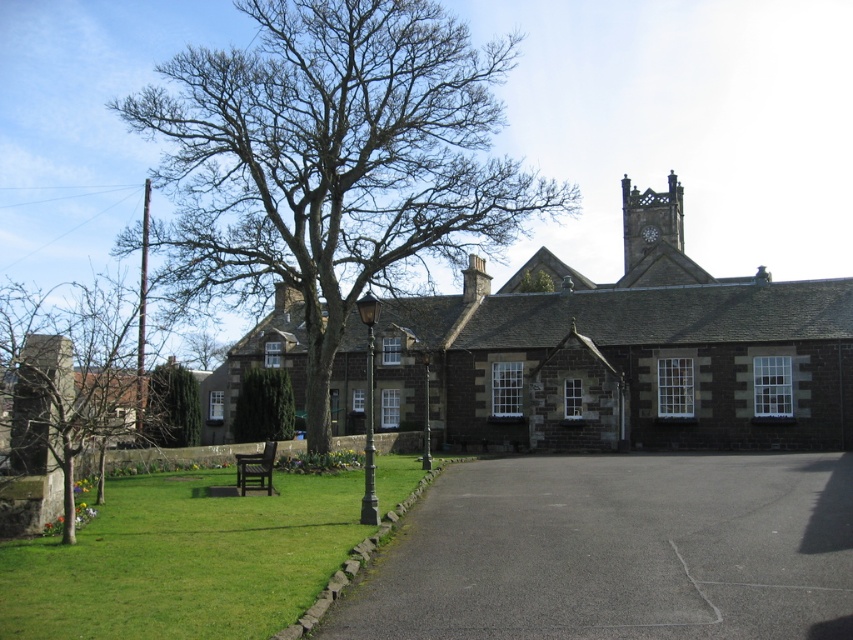
Can you confirm if brown stone church at center is positioned above bare wood tree at center?

Yes, brown stone church at center is above bare wood tree at center.

Where is `brown stone church at center`? brown stone church at center is located at coordinates (624, 353).

How much distance is there between bare wood tree at center and dark brown wooden bench at center?

bare wood tree at center is 38.25 meters away from dark brown wooden bench at center.

Which is in front, point (84, 339) or point (262, 477)?

Point (262, 477) is in front.

The width and height of the screenshot is (853, 640). I want to click on bare wood tree at center, so click(61, 392).

Can you confirm if green leafy tree at center is thinner than green textured hedge at center?

No, green leafy tree at center is not thinner than green textured hedge at center.

Where is `green leafy tree at center`? The image size is (853, 640). green leafy tree at center is located at coordinates (172, 406).